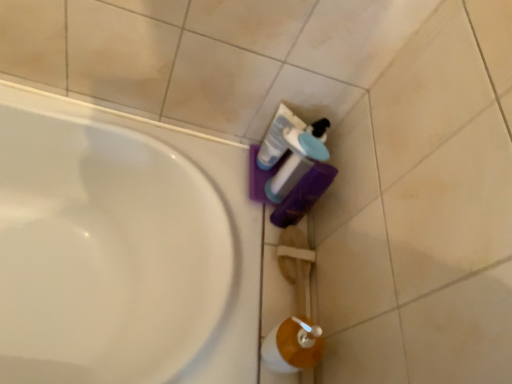
Question: Considering the relative positions of translucent plastic bottle at lower right and white glossy mouthwash at center in the image provided, is translucent plastic bottle at lower right to the left or to the right of white glossy mouthwash at center?

Choices:
 (A) left
 (B) right

Answer: (B)

Question: Based on their sizes in the image, would you say translucent plastic bottle at lower right is bigger or smaller than white glossy mouthwash at center?

Choices:
 (A) big
 (B) small

Answer: (A)

Question: In terms of width, does translucent plastic bottle at lower right look wider or thinner when compared to white glossy mouthwash at center?

Choices:
 (A) thin
 (B) wide

Answer: (B)

Question: From the image's perspective, is white glossy mouthwash at center positioned above or below translucent plastic bottle at lower right?

Choices:
 (A) above
 (B) below

Answer: (A)

Question: Is white glossy mouthwash at center wider or thinner than translucent plastic bottle at lower right?

Choices:
 (A) wide
 (B) thin

Answer: (B)

Question: Is white glossy mouthwash at center in front of or behind translucent plastic bottle at lower right in the image?

Choices:
 (A) front
 (B) behind

Answer: (B)

Question: Is white glossy mouthwash at center spatially inside translucent plastic bottle at lower right, or outside of it?

Choices:
 (A) outside
 (B) inside

Answer: (A)